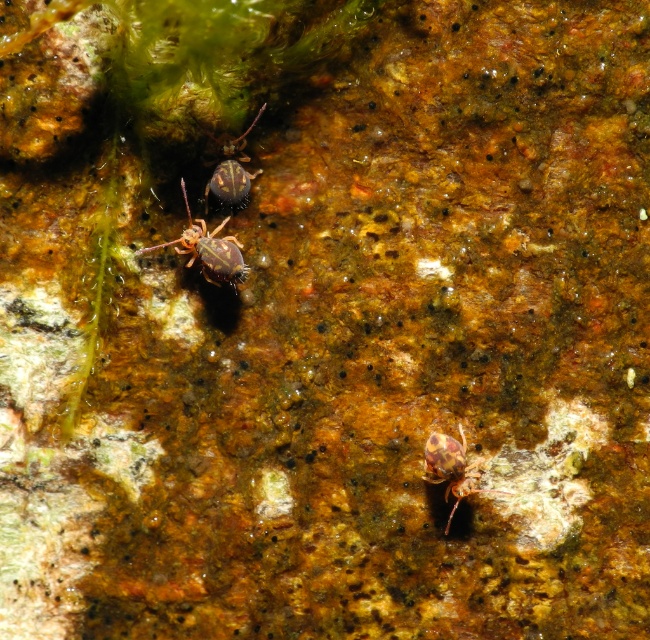
Question: Which of the following is the farthest from the observer?

Choices:
 (A) shiny brown spider at center
 (B) brown textured spider at center
 (C) brown spotted spider at center

Answer: (A)

Question: Which point is closer to the camera taking this photo?

Choices:
 (A) (452, 502)
 (B) (205, 275)
 (C) (216, 182)

Answer: (A)

Question: Is brown textured spider at center bigger than brown spotted spider at center?

Choices:
 (A) no
 (B) yes

Answer: (B)

Question: Does brown textured spider at center appear on the right side of brown spotted spider at center?

Choices:
 (A) no
 (B) yes

Answer: (A)

Question: Observing the image, what is the correct spatial positioning of brown textured spider at center in reference to brown spotted spider at center?

Choices:
 (A) below
 (B) above

Answer: (B)

Question: Based on their relative distances, which object is farther from the brown textured spider at center?

Choices:
 (A) shiny brown spider at center
 (B) brown spotted spider at center

Answer: (B)